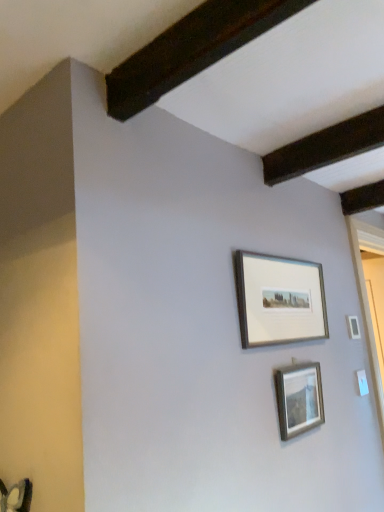
Question: Is silver metallic picture frame at center, which appears as the 1th picture frame when ordered from the bottom, closer to the viewer compared to silver metallic picture frame at upper center, the first picture frame when ordered from top to bottom?

Choices:
 (A) no
 (B) yes

Answer: (A)

Question: Is silver metallic picture frame at center, acting as the second picture frame starting from the top, facing towards silver metallic picture frame at upper center, the first picture frame when ordered from top to bottom?

Choices:
 (A) yes
 (B) no

Answer: (B)

Question: Would you say silver metallic picture frame at center, acting as the second picture frame starting from the top, contains silver metallic picture frame at upper center, the first picture frame when ordered from top to bottom?

Choices:
 (A) no
 (B) yes

Answer: (A)

Question: Is silver metallic picture frame at center, acting as the second picture frame starting from the top, looking in the opposite direction of silver metallic picture frame at upper center, the second picture frame from the bottom?

Choices:
 (A) no
 (B) yes

Answer: (A)

Question: Is silver metallic picture frame at center, acting as the second picture frame starting from the top, not near silver metallic picture frame at upper center, the first picture frame when ordered from top to bottom?

Choices:
 (A) yes
 (B) no

Answer: (B)

Question: Is silver metallic picture frame at center, which appears as the 1th picture frame when ordered from the bottom, touching silver metallic picture frame at upper center, the second picture frame from the bottom?

Choices:
 (A) no
 (B) yes

Answer: (A)

Question: From a real-world perspective, is silver metallic picture frame at upper center, the first picture frame when ordered from top to bottom, below silver metallic picture frame at center, acting as the second picture frame starting from the top?

Choices:
 (A) no
 (B) yes

Answer: (A)

Question: From a real-world perspective, is silver metallic picture frame at upper center, the first picture frame when ordered from top to bottom, over silver metallic picture frame at center, which appears as the 1th picture frame when ordered from the bottom?

Choices:
 (A) yes
 (B) no

Answer: (A)

Question: Considering the relative sizes of silver metallic picture frame at upper center, the first picture frame when ordered from top to bottom, and silver metallic picture frame at center, which appears as the 1th picture frame when ordered from the bottom, in the image provided, is silver metallic picture frame at upper center, the first picture frame when ordered from top to bottom, bigger than silver metallic picture frame at center, which appears as the 1th picture frame when ordered from the bottom,?

Choices:
 (A) yes
 (B) no

Answer: (A)

Question: Considering the relative positions of silver metallic picture frame at upper center, the second picture frame from the bottom, and silver metallic picture frame at center, which appears as the 1th picture frame when ordered from the bottom, in the image provided, is silver metallic picture frame at upper center, the second picture frame from the bottom, behind silver metallic picture frame at center, which appears as the 1th picture frame when ordered from the bottom,?

Choices:
 (A) yes
 (B) no

Answer: (B)

Question: Does silver metallic picture frame at upper center, the second picture frame from the bottom, contain silver metallic picture frame at center, which appears as the 1th picture frame when ordered from the bottom?

Choices:
 (A) no
 (B) yes

Answer: (A)

Question: Is silver metallic picture frame at upper center, the second picture frame from the bottom, looking in the opposite direction of silver metallic picture frame at center, which appears as the 1th picture frame when ordered from the bottom?

Choices:
 (A) no
 (B) yes

Answer: (A)

Question: In the image, is silver metallic picture frame at upper center, the second picture frame from the bottom, positioned in front of or behind silver metallic picture frame at center, acting as the second picture frame starting from the top?

Choices:
 (A) front
 (B) behind

Answer: (A)